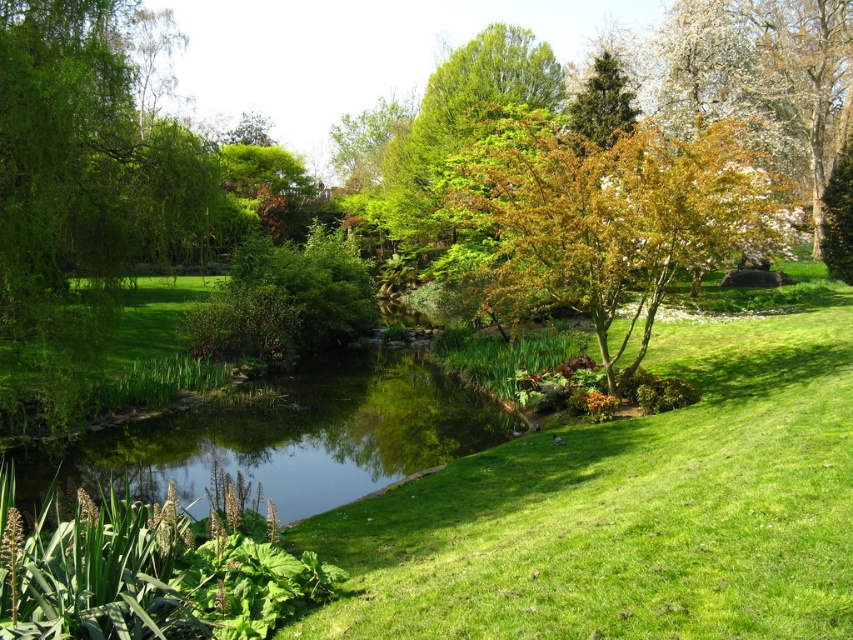
This screenshot has height=640, width=853. In order to click on green grassy park at center in this screenshot , I will do `click(631, 508)`.

Between point (535, 509) and point (637, 288), which one is positioned behind?

The point (637, 288) is more distant.

Does point (590, 484) lie behind point (538, 284)?

No.

This screenshot has height=640, width=853. What are the coordinates of `green grassy park at center` in the screenshot? It's located at (631, 508).

Is green grassy park at center bigger than green leafy tree at left?

No.

Is green grassy park at center above green leafy tree at left?

No, green grassy park at center is not above green leafy tree at left.

The image size is (853, 640). What are the coordinates of `green grassy park at center` in the screenshot? It's located at (631, 508).

Can you confirm if green leafy tree at left is taller than green leafy tree at upper center?

Indeed, green leafy tree at left has a greater height compared to green leafy tree at upper center.

Find the location of a particular element. The width and height of the screenshot is (853, 640). green leafy tree at left is located at coordinates (83, 195).